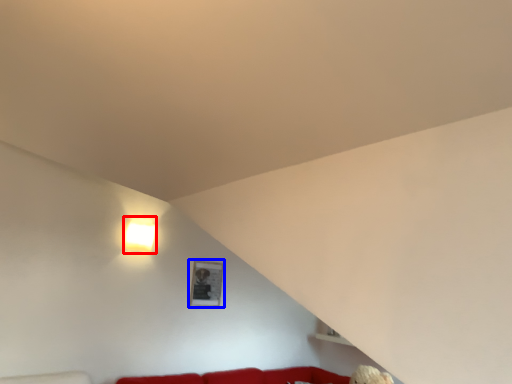
Question: Which object appears closest to the camera in this image, lamp (highlighted by a red box) or picture frame (highlighted by a blue box)?

Choices:
 (A) lamp
 (B) picture frame

Answer: (A)